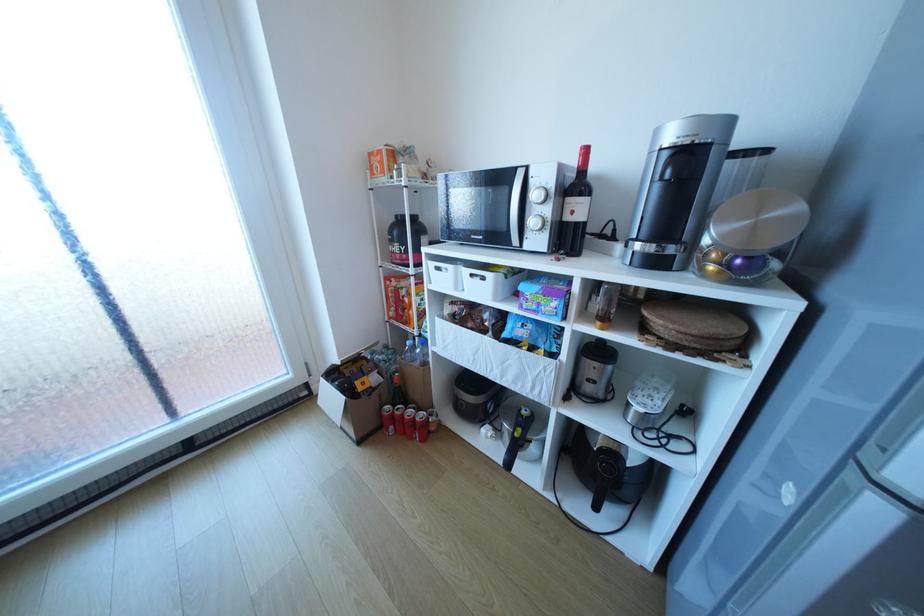
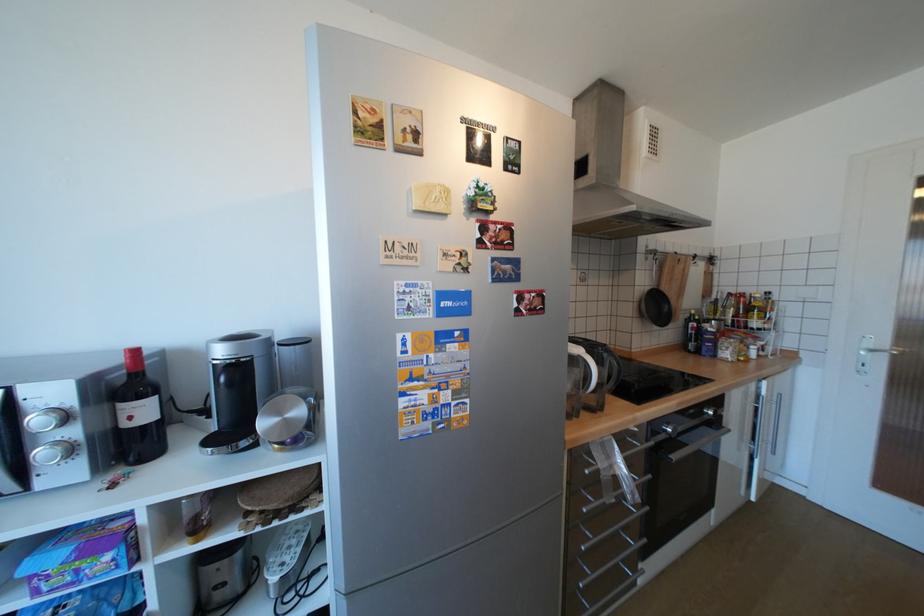
The point at [581,213] is marked in the first image. Where is the corresponding point in the second image?

(140, 418)